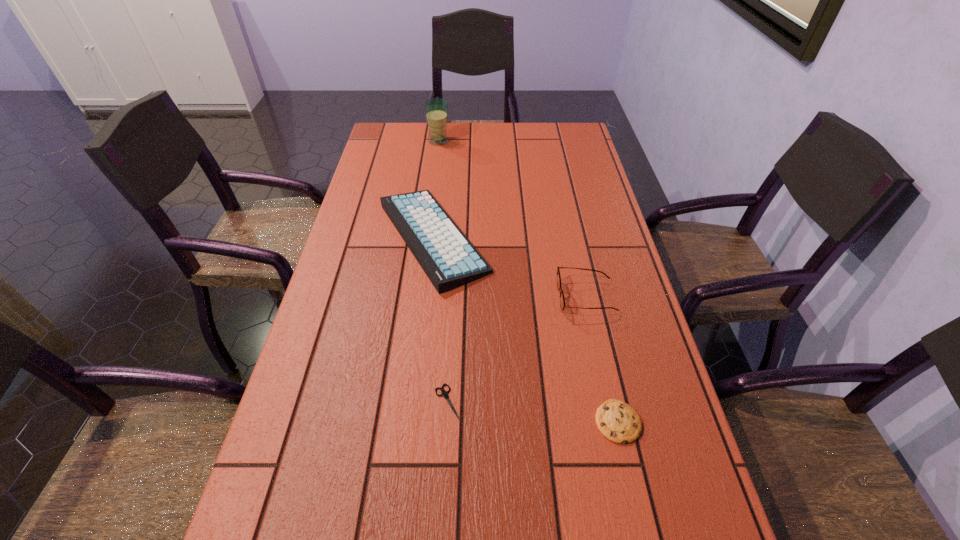
Identify the location of vacant area at the far left corner. This screenshot has height=540, width=960. pyautogui.click(x=413, y=147).

Where is `free region at the far right corner of the desktop`? The height and width of the screenshot is (540, 960). free region at the far right corner of the desktop is located at coordinates (575, 150).

Image resolution: width=960 pixels, height=540 pixels. Find the location of `free space between the fourth tallest object and the computer keyboard`. free space between the fourth tallest object and the computer keyboard is located at coordinates (x=525, y=329).

Find the location of `free area in between the spectacles and the computer keyboard`. free area in between the spectacles and the computer keyboard is located at coordinates click(x=510, y=267).

What are the coordinates of `vacant region between the computer keyboard and the shears` in the screenshot? It's located at (441, 320).

Find the location of a particular element. The image size is (960, 540). free space between the cookie and the computer keyboard is located at coordinates (525, 329).

At what (x,y) coordinates should I click in order to perform the action: click on blank region between the spectacles and the shortest object. Please return your answer as a coordinate pair (x, y). Looking at the image, I should click on (516, 350).

Where is `free space between the tallest object and the computer keyboard`? The width and height of the screenshot is (960, 540). free space between the tallest object and the computer keyboard is located at coordinates (436, 189).

Image resolution: width=960 pixels, height=540 pixels. I want to click on free space between the spectacles and the computer keyboard, so click(510, 267).

Where is `unoccupied area between the tallest object and the computer keyboard`? The image size is (960, 540). unoccupied area between the tallest object and the computer keyboard is located at coordinates pyautogui.click(x=436, y=189).